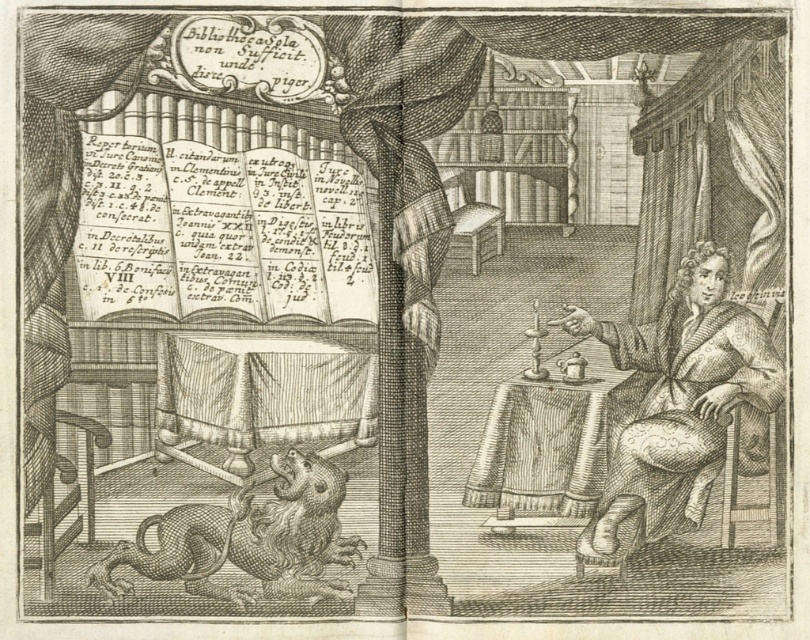
Question: Is matte black book at center left positioned at the back of brown textured lion at lower left?

Choices:
 (A) no
 (B) yes

Answer: (B)

Question: Considering the real-world distances, which object is farthest from the matte black book at center left?

Choices:
 (A) brown textured lion at lower left
 (B) wooden table at lower right
 (C) smooth brown robe at right

Answer: (C)

Question: Is matte black book at center left behind smooth brown robe at right?

Choices:
 (A) no
 (B) yes

Answer: (B)

Question: Which point is closer to the camera taking this photo?

Choices:
 (A) (590, 456)
 (B) (245, 602)
 (C) (766, 342)

Answer: (B)

Question: Is matte black book at center left bigger than wooden table at lower right?

Choices:
 (A) no
 (B) yes

Answer: (A)

Question: Which object is the farthest from the matte black book at center left?

Choices:
 (A) brown textured lion at lower left
 (B) smooth brown robe at right
 (C) wooden table at lower right

Answer: (B)